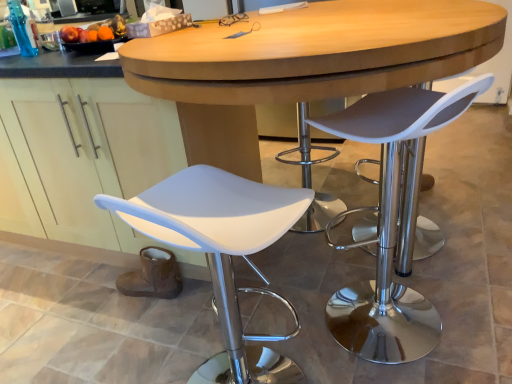
The height and width of the screenshot is (384, 512). Identify the location of vacant area that is situated to the right of matte gray seat at right, placed as the second chair when sorted from left to right. (466, 302).